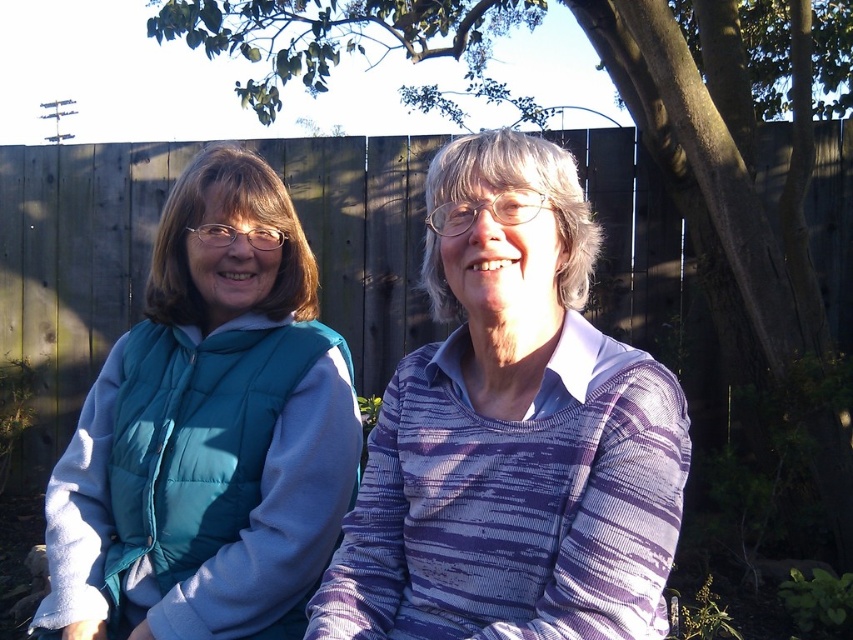
Is point (432, 621) in front of point (320, 488)?

Yes, point (432, 621) is closer to viewer.

Where is `striped sweater at center`? The height and width of the screenshot is (640, 853). striped sweater at center is located at coordinates (512, 433).

Where is `striped sweater at center`? striped sweater at center is located at coordinates (512, 433).